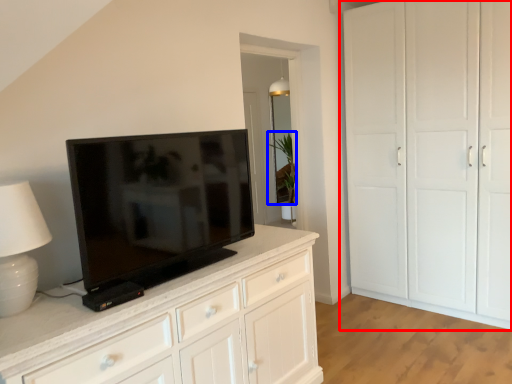
Question: Which point is closer to the camera, cupboard (highlighted by a red box) or plant (highlighted by a blue box)?

Choices:
 (A) cupboard
 (B) plant

Answer: (A)